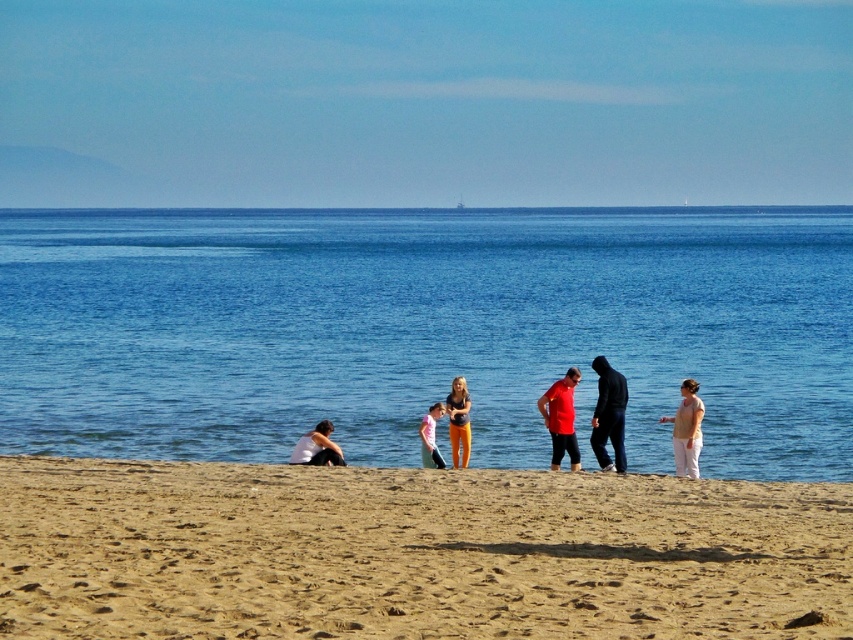
You are standing on the beach and want to walk to the two points marked in the image. Which point, point (140, 582) or point (618, 381), is closer to you?

Point (140, 582) is closer to the viewer than point (618, 381).

You are standing at the point marked by coordinates point (x=412, y=552) on the beach. Looking around, you see the person sitting on the sand to your left and the man in a red shirt walking to your right. Which direction should you turn to face the fine grained sand at lower center?

The fine grained sand at lower center is represented by point (x=412, y=552), so you are already standing on it. Therefore, you don not need to turn in any direction to face it.